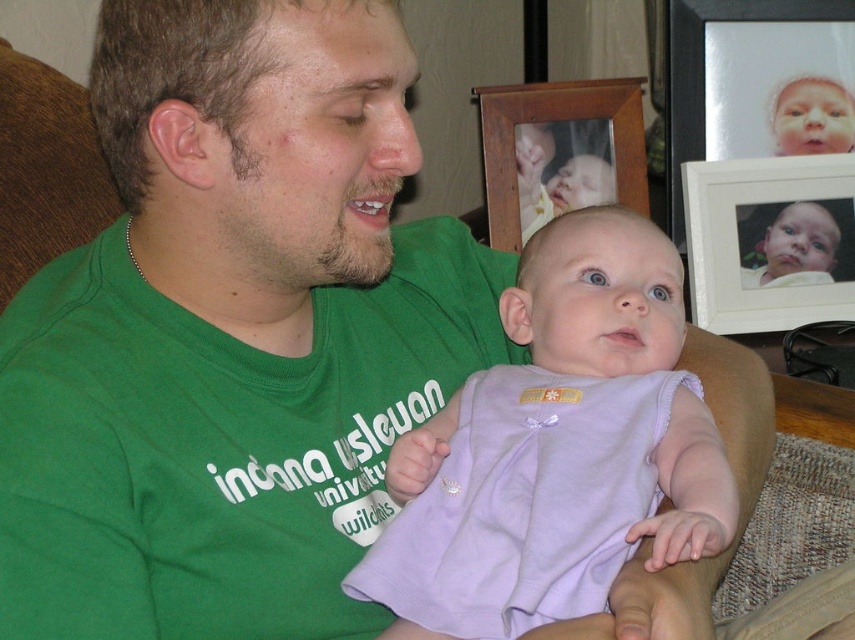
Between lavender fabric baby at center and wooden picture frame at upper center, which one has less height?

Standing shorter between the two is wooden picture frame at upper center.

Identify the location of lavender fabric baby at center. The image size is (855, 640). (557, 449).

Where is `lavender fabric baby at center`? The width and height of the screenshot is (855, 640). lavender fabric baby at center is located at coordinates (557, 449).

Which is below, white matte picture frame at upper right or wooden picture frame at upper center?

white matte picture frame at upper right is below.

Is point (840, 179) less distant than point (590, 104)?

Yes, point (840, 179) is in front of point (590, 104).

Between point (828, 280) and point (503, 141), which one is positioned in front?

Positioned in front is point (828, 280).

Locate an element on the screen. The image size is (855, 640). white matte picture frame at upper right is located at coordinates (770, 241).

What do you see at coordinates (557, 449) in the screenshot? The height and width of the screenshot is (640, 855). I see `lavender fabric baby at center` at bounding box center [557, 449].

You are a GUI agent. You are given a task and a screenshot of the screen. Output one action in this format:
    pyautogui.click(x=<x>, y=<y>)
    Task: Click on the lavender fabric baby at center
    
    Given the screenshot: What is the action you would take?
    pyautogui.click(x=557, y=449)